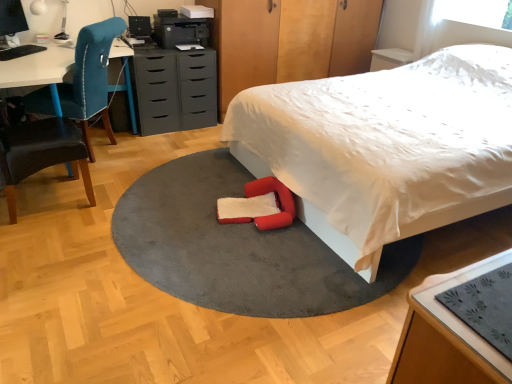
Question: From the image's perspective, is white glossy table lamp at upper left located above wooden table at lower right?

Choices:
 (A) yes
 (B) no

Answer: (A)

Question: Is white glossy table lamp at upper left beside wooden table at lower right?

Choices:
 (A) yes
 (B) no

Answer: (B)

Question: From a real-world perspective, is white glossy table lamp at upper left positioned over wooden table at lower right based on gravity?

Choices:
 (A) no
 (B) yes

Answer: (B)

Question: Is white glossy table lamp at upper left not near wooden table at lower right?

Choices:
 (A) no
 (B) yes

Answer: (B)

Question: Is the position of white glossy table lamp at upper left less distant than that of wooden table at lower right?

Choices:
 (A) no
 (B) yes

Answer: (A)

Question: Is white glossy table lamp at upper left at the right side of wooden table at lower right?

Choices:
 (A) yes
 (B) no

Answer: (B)

Question: Does velvet teal chair at left, which is counted as the 1th chair, starting from the back, come behind wooden table at lower right?

Choices:
 (A) yes
 (B) no

Answer: (A)

Question: Considering the relative positions of velvet teal chair at left, which is counted as the 1th chair, starting from the back, and wooden table at lower right in the image provided, is velvet teal chair at left, which is counted as the 1th chair, starting from the back, to the right of wooden table at lower right from the viewer's perspective?

Choices:
 (A) no
 (B) yes

Answer: (A)

Question: Does velvet teal chair at left, placed as the second chair when sorted from front to back, turn towards wooden table at lower right?

Choices:
 (A) no
 (B) yes

Answer: (A)

Question: From a real-world perspective, is velvet teal chair at left, placed as the second chair when sorted from front to back, located beneath wooden table at lower right?

Choices:
 (A) no
 (B) yes

Answer: (A)

Question: Is velvet teal chair at left, placed as the second chair when sorted from front to back, shorter than wooden table at lower right?

Choices:
 (A) yes
 (B) no

Answer: (B)

Question: From the image's perspective, does velvet teal chair at left, which is counted as the 1th chair, starting from the back, appear lower than wooden table at lower right?

Choices:
 (A) no
 (B) yes

Answer: (A)

Question: Is matte gray chest of drawers at center not near white soft bed at center?

Choices:
 (A) yes
 (B) no

Answer: (A)